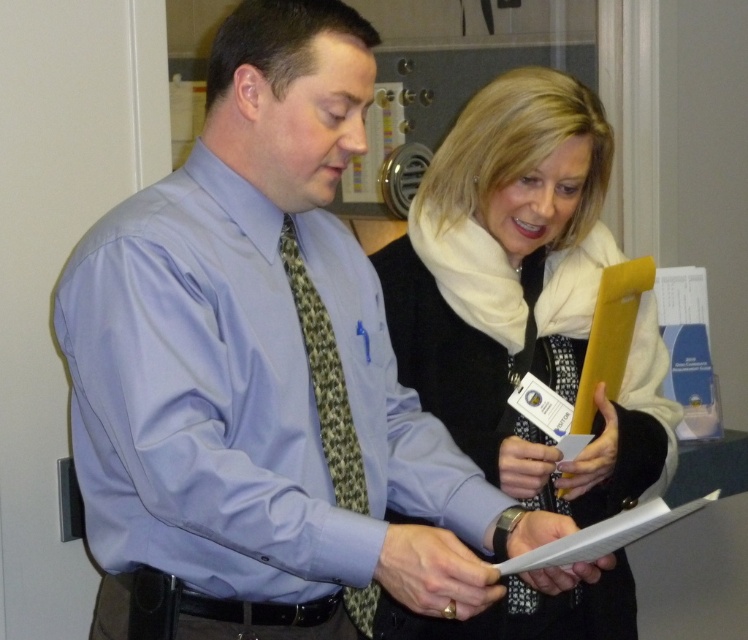
Is white scarf at upper right wider than green patterned tie at center?

Indeed, white scarf at upper right has a greater width compared to green patterned tie at center.

Is point (649, 358) positioned behind point (367, 600)?

Yes, it is.

The height and width of the screenshot is (640, 748). Describe the element at coordinates (524, 296) in the screenshot. I see `white scarf at upper right` at that location.

At what (x,y) coordinates should I click in order to perform the action: click on white scarf at upper right. Please return your answer as a coordinate pair (x, y). Looking at the image, I should click on (524, 296).